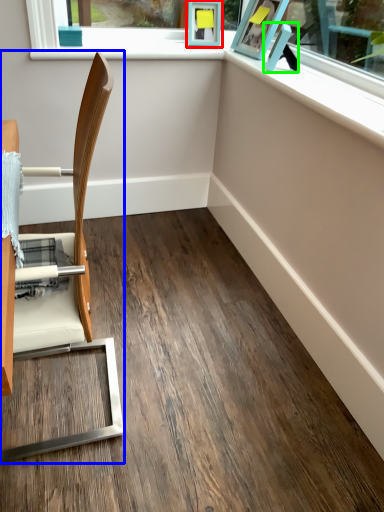
Question: Estimate the real-world distances between objects in this image. Which object is closer to picture frame (highlighted by a red box), chair (highlighted by a blue box) or picture frame (highlighted by a green box)?

Choices:
 (A) chair
 (B) picture frame

Answer: (B)